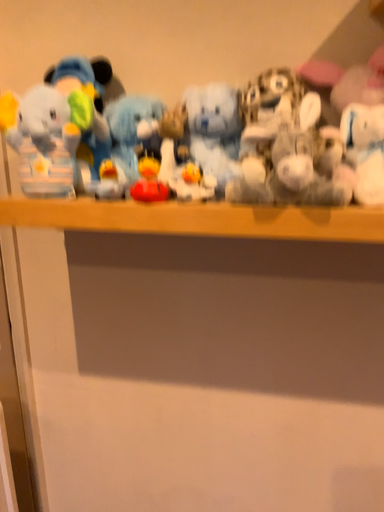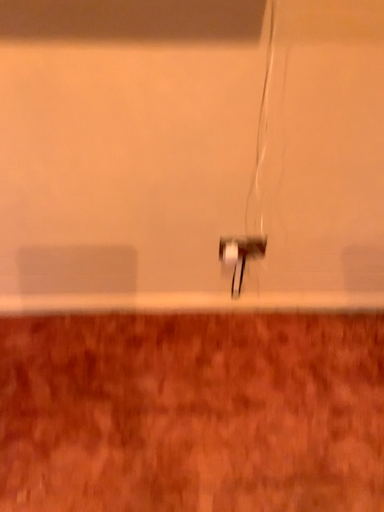
Question: How did the camera likely rotate when shooting the video?

Choices:
 (A) rotated left
 (B) rotated right

Answer: (B)